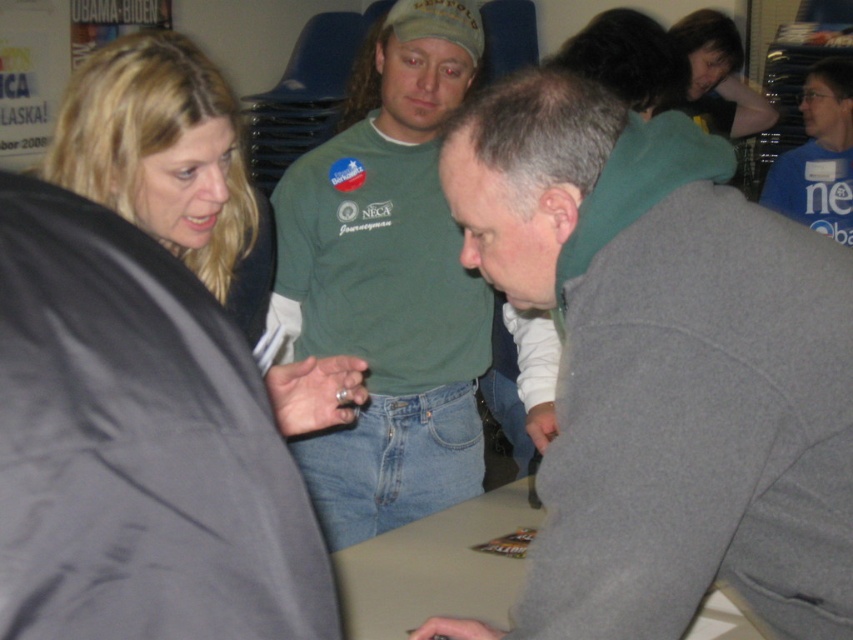
You are standing in the room and want to know which of the two points, point (564,282) or point (402,435), is closer to you. Based on the scene description, which point is nearer?

Point (564,282) is closer to the camera than point (402,435), so it is nearer to you.

You are a photographer setting up for an event. You notice the blonde hair at upper left and the beige matte table at center. Which object is located higher in the image?

The blonde hair at upper left is positioned over the beige matte table at center, so it is higher in the image.